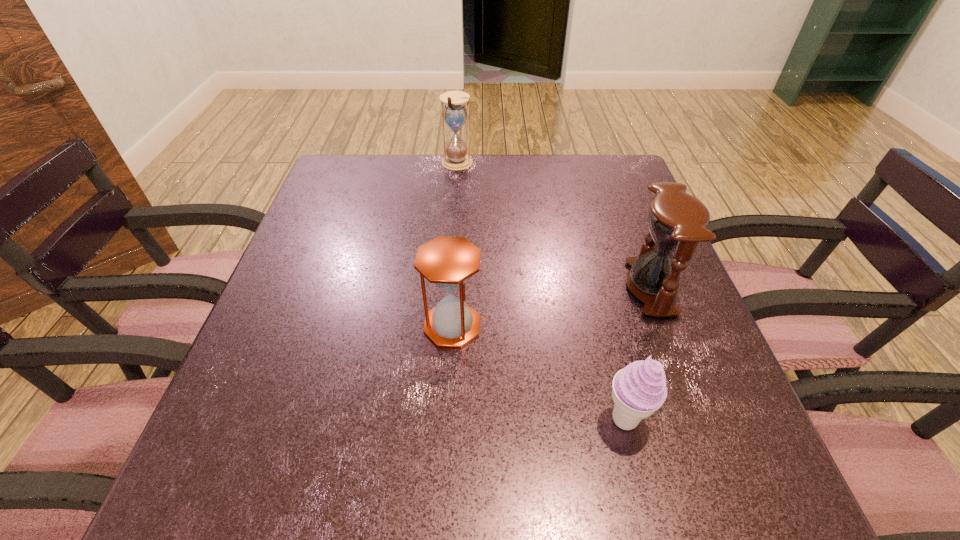
In order to click on vacant space that is in between the icecream and the farthest hourglass in this screenshot , I will do `click(541, 292)`.

Find the location of a particular element. Image resolution: width=960 pixels, height=540 pixels. free area in between the second object from right to left and the shortest hourglass is located at coordinates (540, 373).

This screenshot has width=960, height=540. I want to click on vacant area that lies between the rightmost hourglass and the third object from left to right, so click(x=638, y=354).

Where is `free area in between the rightmost hourglass and the icecream`? free area in between the rightmost hourglass and the icecream is located at coordinates (638, 354).

This screenshot has height=540, width=960. What are the coordinates of `vacant space in between the nearest object and the rightmost hourglass` in the screenshot? It's located at (638, 354).

Point out which object is positioned as the second nearest to the rightmost object. Please provide its 2D coordinates. Your answer should be formatted as a tuple, i.e. [(x, y)], where the tuple contains the x and y coordinates of a point satisfying the conditions above.

[(448, 262)]

Identify the location of object that is the third closest to the farthest object. The image size is (960, 540). (639, 389).

Identify which hourglass is the second closest to the rightmost hourglass. Please provide its 2D coordinates. Your answer should be formatted as a tuple, i.e. [(x, y)], where the tuple contains the x and y coordinates of a point satisfying the conditions above.

[(455, 158)]

The height and width of the screenshot is (540, 960). Find the location of `hourglass identified as the closest to the nearest object`. hourglass identified as the closest to the nearest object is located at coordinates (677, 221).